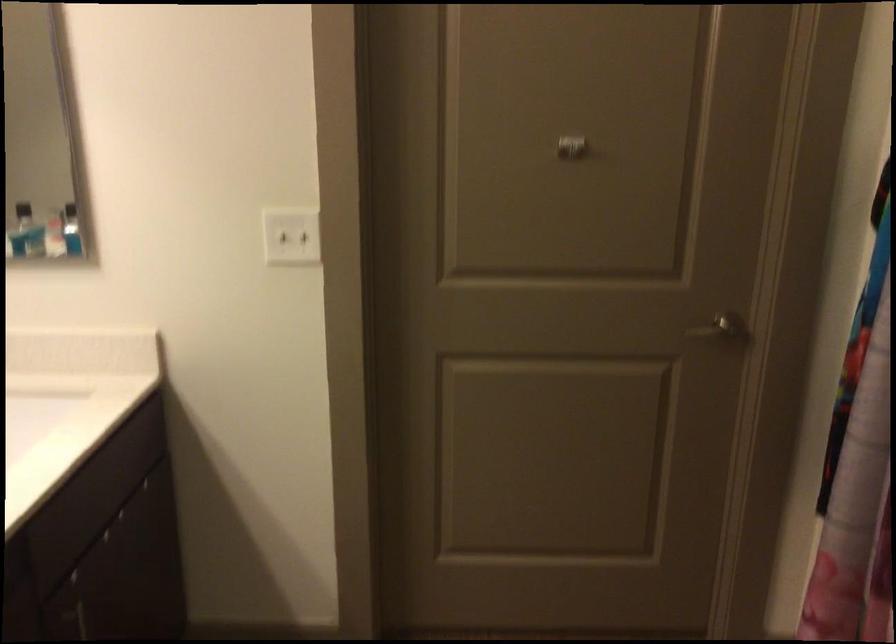
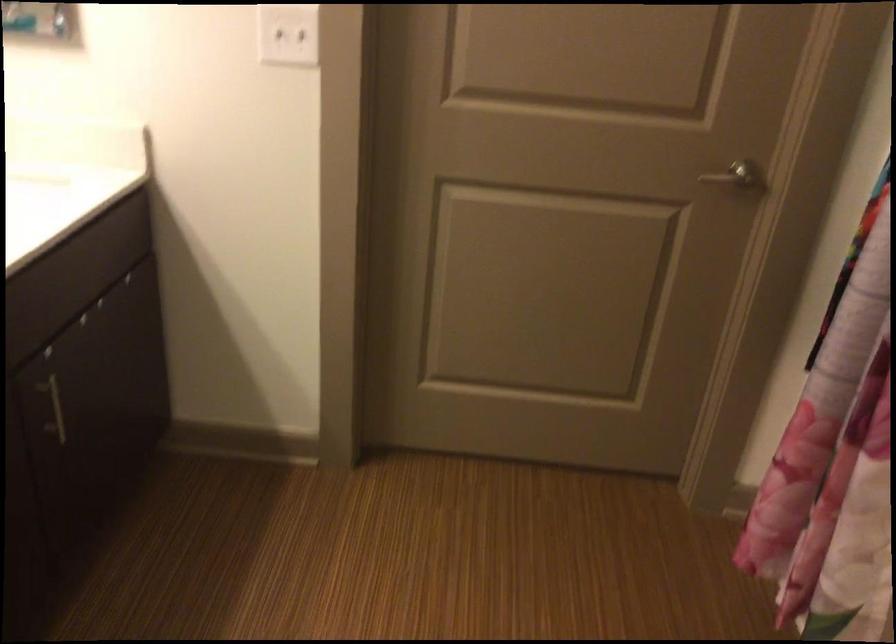
In the second image, find the point that corresponds to (x=727, y=333) in the first image.

(739, 178)